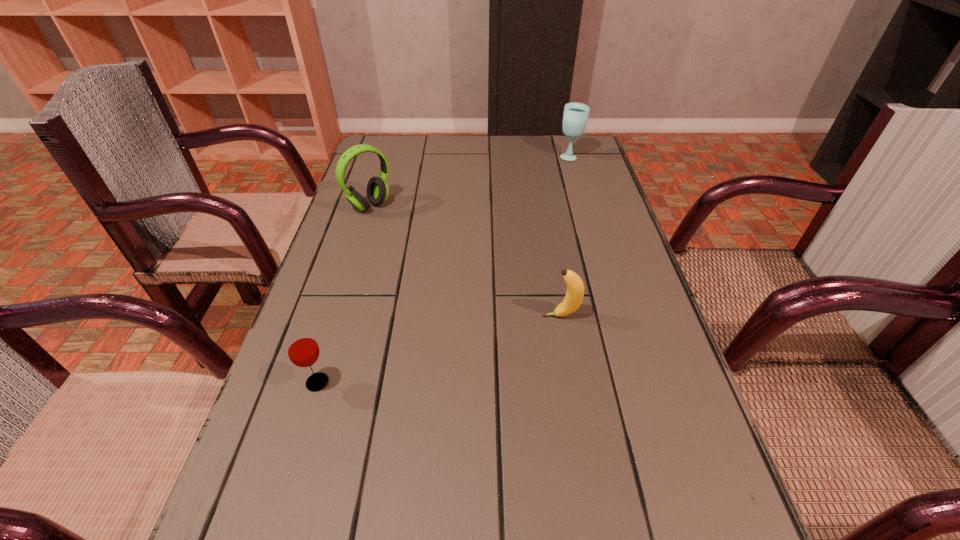
Image resolution: width=960 pixels, height=540 pixels. I want to click on vacant point that satisfies the following two spatial constraints: 1. on the back side of the rightmost object; 2. on the right side of the nearest object, so click(387, 156).

The image size is (960, 540). I want to click on vacant area in the image that satisfies the following two spatial constraints: 1. on the back side of the nearest object; 2. on the left side of the rightmost object, so click(x=387, y=156).